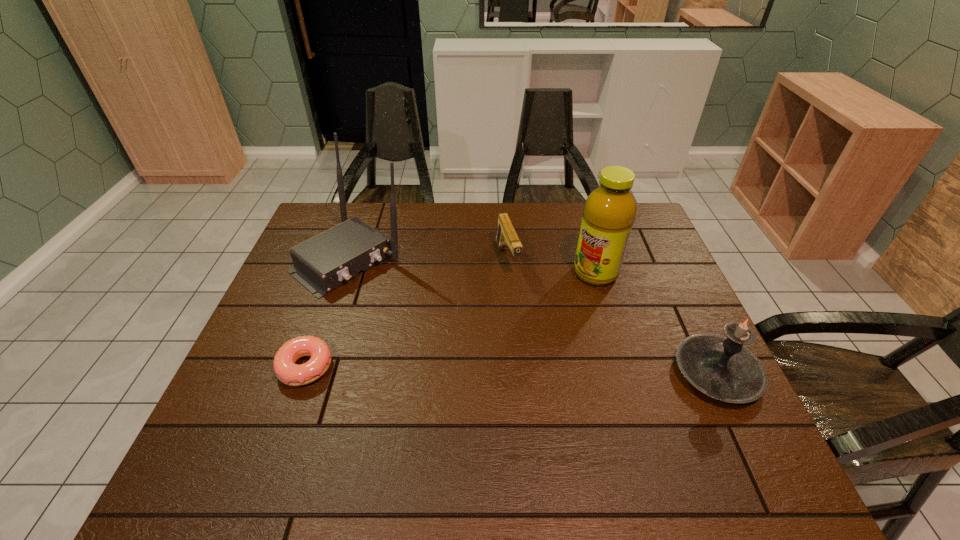
This screenshot has height=540, width=960. I want to click on free point located 0.150m at the barrel of the second shortest object, so click(x=526, y=318).

This screenshot has width=960, height=540. Find the location of `vacant space located 0.310m at the barrel of the second shortest object`. vacant space located 0.310m at the barrel of the second shortest object is located at coordinates (545, 366).

In order to click on free point located 0.200m on the back of the router to connect cables in this screenshot , I will do `click(433, 320)`.

Find the location of a particular element. This screenshot has width=960, height=540. vacant space located 0.320m on the back of the router to connect cables is located at coordinates (466, 345).

At what (x,y) coordinates should I click in order to perform the action: click on free spot located on the back of the router to connect cables. Please return your answer as a coordinate pair (x, y). The width and height of the screenshot is (960, 540). Looking at the image, I should click on (468, 347).

Where is `free space located on the front label of the fourth object from left to right`? Image resolution: width=960 pixels, height=540 pixels. free space located on the front label of the fourth object from left to right is located at coordinates (566, 295).

This screenshot has height=540, width=960. I want to click on vacant space located on the front label of the fourth object from left to right, so click(x=571, y=292).

I want to click on vacant space located on the front label of the fourth object from left to right, so click(x=520, y=331).

Image resolution: width=960 pixels, height=540 pixels. I want to click on pistol that is at the far edge, so click(x=506, y=235).

Where is `router that is at the far edge`? This screenshot has width=960, height=540. router that is at the far edge is located at coordinates (322, 263).